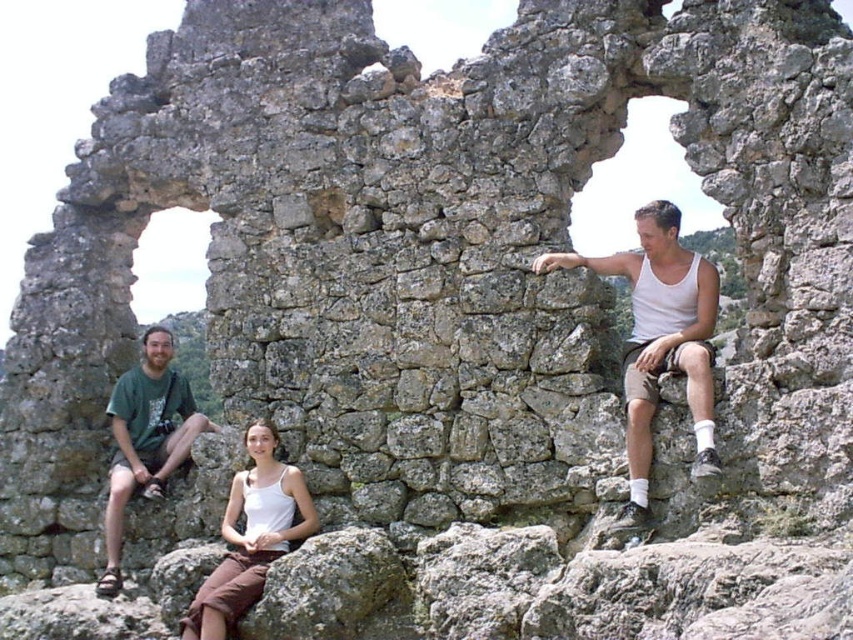
Question: Is white matte tank top at right bigger than white cotton tank top at center?

Choices:
 (A) yes
 (B) no

Answer: (A)

Question: Can you confirm if white matte tank top at right is bigger than green t-shirt at left?

Choices:
 (A) yes
 (B) no

Answer: (A)

Question: Based on their relative distances, which object is nearer to the green t-shirt at left?

Choices:
 (A) white cotton tank top at center
 (B) white matte tank top at right

Answer: (A)

Question: Which object appears farthest from the camera in this image?

Choices:
 (A) white matte tank top at right
 (B) green t-shirt at left

Answer: (B)

Question: Estimate the real-world distances between objects in this image. Which object is closer to the white cotton tank top at center?

Choices:
 (A) green t-shirt at left
 (B) white matte tank top at right

Answer: (A)

Question: Can you confirm if white matte tank top at right is positioned to the right of white cotton tank top at center?

Choices:
 (A) yes
 (B) no

Answer: (A)